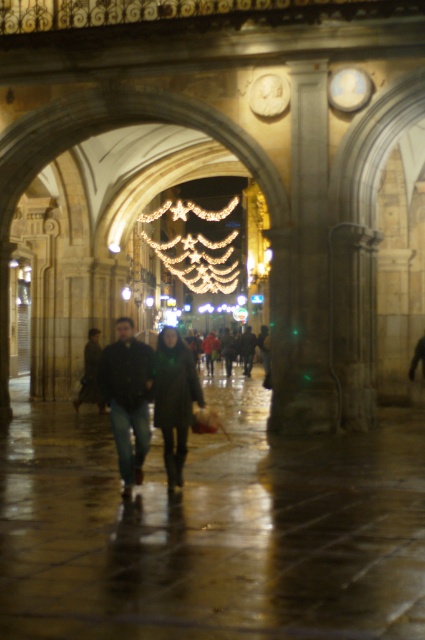
Does dark green leather jacket at center have a greater width compared to dark gray coat at center?

Yes, dark green leather jacket at center is wider than dark gray coat at center.

Based on the photo, between dark green leather jacket at center and dark gray coat at center, which one appears on the left side from the viewer's perspective?

dark gray coat at center

The height and width of the screenshot is (640, 425). In order to click on dark green leather jacket at center in this screenshot , I will do click(127, 397).

Which is behind, point (136, 460) or point (93, 372)?

Positioned behind is point (93, 372).

Between dark blue jeans at center and dark gray coat at center, which one is positioned lower?

Positioned lower is dark gray coat at center.

Who is more forward, (130,388) or (102,397)?

Point (130,388)

Locate an element on the screen. The image size is (425, 640). dark blue jeans at center is located at coordinates (127, 397).

Does dark green leather jacket at center come in front of dark blue jeans at center?

That is True.

Which of these two, dark green leather jacket at center or dark blue jeans at center, stands shorter?

Standing shorter between the two is dark blue jeans at center.

Identify the location of dark green leather jacket at center. (127, 397).